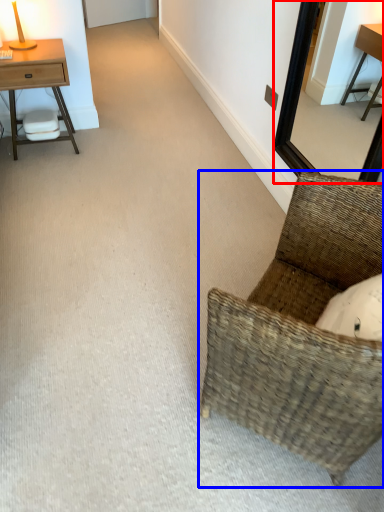
Question: Which object is further to the camera taking this photo, mirror (highlighted by a red box) or chair (highlighted by a blue box)?

Choices:
 (A) mirror
 (B) chair

Answer: (A)